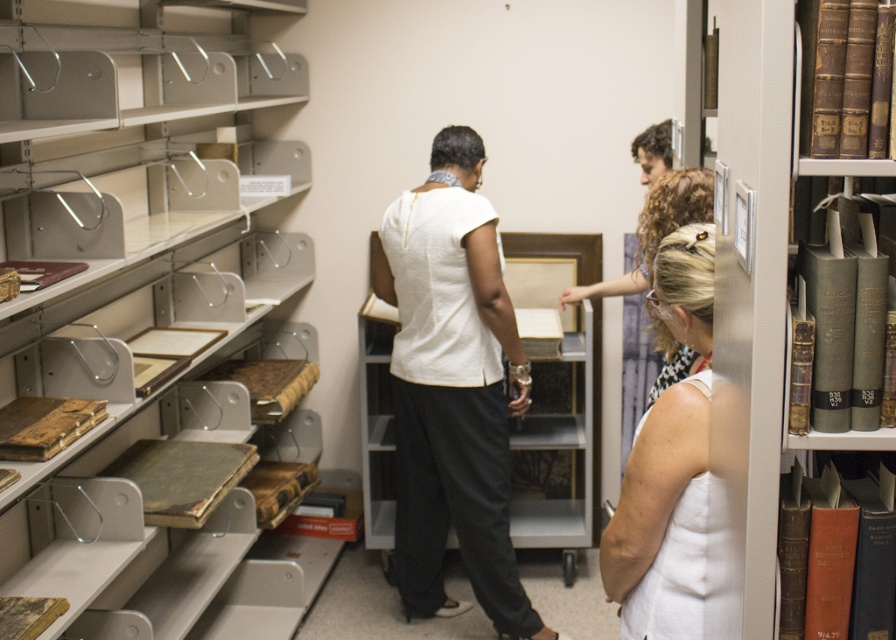
Question: Can you confirm if matte metal bookcase at left is thinner than green leather books at right?

Choices:
 (A) yes
 (B) no

Answer: (B)

Question: Observing the image, what is the correct spatial positioning of green leather books at right in reference to white fabric dress at center?

Choices:
 (A) right
 (B) left

Answer: (A)

Question: In this image, where is matte metal bookcase at left located relative to white matte shirt at center?

Choices:
 (A) below
 (B) above

Answer: (B)

Question: Which object is positioned farthest from the white fabric dress at center?

Choices:
 (A) green leather books at right
 (B) matte metal bookcase at left

Answer: (B)

Question: Which point is farther from the camera taking this photo?

Choices:
 (A) (672, 593)
 (B) (731, 3)
 (C) (282, 314)
 (D) (495, 476)

Answer: (C)

Question: Which object is closer to the camera taking this photo?

Choices:
 (A) white matte shirt at center
 (B) matte metal bookcase at left

Answer: (B)